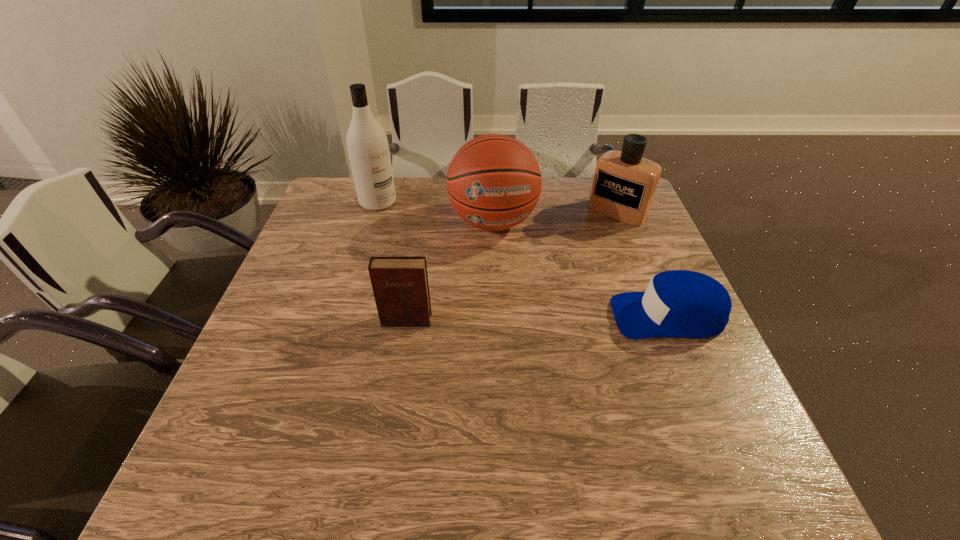
The width and height of the screenshot is (960, 540). I want to click on vacant space situated 0.400m on the front-facing side of the shortest object, so click(443, 315).

This screenshot has height=540, width=960. Find the location of `free space located on the logo side of the basketball`. free space located on the logo side of the basketball is located at coordinates (501, 267).

At what (x,y) coordinates should I click in order to perform the action: click on free space located on the logo side of the basketball. Please return your answer as a coordinate pair (x, y). The height and width of the screenshot is (540, 960). Looking at the image, I should click on (507, 305).

Identify the location of vacant space located 0.120m on the logo side of the basketball. The height and width of the screenshot is (540, 960). (503, 279).

I want to click on vacant position located 0.090m on the front label of the perfume, so click(590, 239).

Find the location of a particular element. The image size is (960, 540). vacant space located 0.350m on the front label of the perfume is located at coordinates (542, 289).

This screenshot has height=540, width=960. What are the coordinates of `vacant space situated 0.200m on the front label of the perfume` in the screenshot? It's located at (571, 259).

Find the location of a particular element. The width and height of the screenshot is (960, 540). vacant space situated on the front-facing side of the tallest object is located at coordinates (398, 219).

Find the location of a particular element. blank space located on the front-facing side of the tallest object is located at coordinates (462, 269).

Identify the location of vacant space located on the front-facing side of the tallest object. pyautogui.click(x=459, y=268).